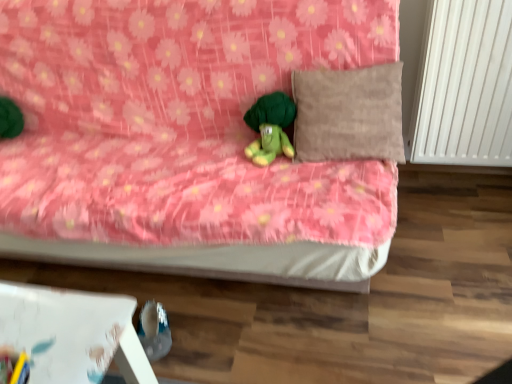
Measure the distance between pink floral fabric bed at center and camera.

The distance of pink floral fabric bed at center from camera is 3.65 feet.

Find the location of a particular element. white smooth radiator at right is located at coordinates click(x=464, y=86).

You are a GUI agent. You are given a task and a screenshot of the screen. Output one action in this format:
    pyautogui.click(x=<x>, y=<y>)
    Task: Click on the suede-like beige pillow at upper right
    This screenshot has width=512, height=384.
    Given the screenshot: What is the action you would take?
    pyautogui.click(x=349, y=114)

Where is `pink floral fabric bed at center`? This screenshot has width=512, height=384. pink floral fabric bed at center is located at coordinates (186, 139).

From the image's perspective, which is above, suede-like beige pillow at upper right or white smooth radiator at right?

white smooth radiator at right is shown above in the image.

Considering the relative positions of suede-like beige pillow at upper right and white smooth radiator at right in the image provided, is suede-like beige pillow at upper right to the left or to the right of white smooth radiator at right?

suede-like beige pillow at upper right is to the left of white smooth radiator at right.

Is suede-like beige pillow at upper right bigger or smaller than white smooth radiator at right?

In the image, suede-like beige pillow at upper right appears to be smaller than white smooth radiator at right.

How different are the orientations of suede-like beige pillow at upper right and white smooth radiator at right in degrees?

The angular difference between suede-like beige pillow at upper right and white smooth radiator at right is 4.84 degrees.

Which is closer, (x=248, y=113) or (x=471, y=134)?

Point (x=248, y=113).

From a real-world perspective, does green plush turtle at center stand above white smooth radiator at right?

Yes, from a real-world perspective, green plush turtle at center is on top of white smooth radiator at right.

Does green plush turtle at center come behind white smooth radiator at right?

Yes, it is.

Is green plush turtle at center far away from white smooth radiator at right?

green plush turtle at center is actually quite close to white smooth radiator at right.

Find the location of a particular element. toy below the suede-like beige pillow at upper right (from the image's perspective) is located at coordinates (270, 127).

Is suede-like beige pillow at upper right touching green plush turtle at center?

No.

How many degrees apart are the facing directions of suede-like beige pillow at upper right and green plush turtle at center?

The facing directions of suede-like beige pillow at upper right and green plush turtle at center are 7.83e-05 degrees apart.

Which of these two, suede-like beige pillow at upper right or green plush turtle at center, is wider?

Wider between the two is suede-like beige pillow at upper right.

Considering the sizes of green plush turtle at center and suede-like beige pillow at upper right in the image, is green plush turtle at center taller or shorter than suede-like beige pillow at upper right?

Clearly, green plush turtle at center is shorter compared to suede-like beige pillow at upper right.

Is green plush turtle at center in contact with suede-like beige pillow at upper right?

No, green plush turtle at center is not beside suede-like beige pillow at upper right.

Between green plush turtle at center and suede-like beige pillow at upper right, which one is positioned in front?

suede-like beige pillow at upper right is more forward.

From a real-world perspective, does green plush turtle at center stand above suede-like beige pillow at upper right?

No, from a real-world perspective, green plush turtle at center is not on top of suede-like beige pillow at upper right.

Based on the photo, considering the relative sizes of green plush turtle at center and pink floral fabric bed at center in the image provided, is green plush turtle at center shorter than pink floral fabric bed at center?

Yes, green plush turtle at center is shorter than pink floral fabric bed at center.

From a real-world perspective, which object rests below the other?

pink floral fabric bed at center, from a real-world perspective.

Between green plush turtle at center and pink floral fabric bed at center, which one has larger width?

With larger width is pink floral fabric bed at center.

Is green plush turtle at center positioned far away from pink floral fabric bed at center?

green plush turtle at center is near pink floral fabric bed at center, not far away.

Considering the points (198, 145) and (421, 135), which point is in front, point (198, 145) or point (421, 135)?

Point (198, 145)

Is pink floral fabric bed at center aimed at white smooth radiator at right?

No.

Looking at the image, does pink floral fabric bed at center seem bigger or smaller compared to white smooth radiator at right?

Considering their sizes, pink floral fabric bed at center takes up more space than white smooth radiator at right.

Measure the distance between pink floral fabric bed at center and white smooth radiator at right.

A distance of 29.04 inches exists between pink floral fabric bed at center and white smooth radiator at right.

In terms of width, does white smooth radiator at right look wider or thinner when compared to pink floral fabric bed at center?

Considering their sizes, white smooth radiator at right looks slimmer than pink floral fabric bed at center.

Which is behind, point (437, 93) or point (342, 224)?

Positioned behind is point (437, 93).

Is white smooth radiator at right behind pink floral fabric bed at center?

Yes, white smooth radiator at right is further from the camera.

Is white smooth radiator at right to the left of pink floral fabric bed at center from the viewer's perspective?

No.

This screenshot has height=384, width=512. In order to click on radiator on the right side of suede-like beige pillow at upper right in this screenshot , I will do `click(464, 86)`.

At what (x,y) coordinates should I click in order to perform the action: click on radiator below the green plush turtle at center (from a real-world perspective). Please return your answer as a coordinate pair (x, y). The width and height of the screenshot is (512, 384). Looking at the image, I should click on (464, 86).

Looking at the image, which one is located closer to suede-like beige pillow at upper right, green plush turtle at center or pink floral fabric bed at center?

Based on the image, green plush turtle at center appears to be nearer to suede-like beige pillow at upper right.

Estimate the real-world distances between objects in this image. Which object is further from green plush turtle at center, white smooth radiator at right or pink floral fabric bed at center?

white smooth radiator at right.

In the scene shown: From the image, which object appears to be farther from pink floral fabric bed at center, green plush turtle at center or suede-like beige pillow at upper right?

green plush turtle at center lies further to pink floral fabric bed at center than the other object.

Which object lies nearer to the anchor point suede-like beige pillow at upper right, pink floral fabric bed at center or green plush turtle at center?

Based on the image, green plush turtle at center appears to be nearer to suede-like beige pillow at upper right.

When comparing their distances from green plush turtle at center, does white smooth radiator at right or suede-like beige pillow at upper right seem further?

white smooth radiator at right lies further to green plush turtle at center than the other object.

When comparing their distances from suede-like beige pillow at upper right, does white smooth radiator at right or green plush turtle at center seem closer?

green plush turtle at center.

From the image, which object appears to be nearer to white smooth radiator at right, green plush turtle at center or suede-like beige pillow at upper right?

suede-like beige pillow at upper right lies closer to white smooth radiator at right than the other object.

Estimate the real-world distances between objects in this image. Which object is closer to suede-like beige pillow at upper right, pink floral fabric bed at center or white smooth radiator at right?

pink floral fabric bed at center is positioned closer to the anchor suede-like beige pillow at upper right.

Where is `pillow situated between green plush turtle at center and white smooth radiator at right from left to right`? The height and width of the screenshot is (384, 512). pillow situated between green plush turtle at center and white smooth radiator at right from left to right is located at coordinates (349, 114).

The image size is (512, 384). In order to click on pillow situated between pink floral fabric bed at center and white smooth radiator at right from left to right in this screenshot , I will do `click(349, 114)`.

Identify the location of toy between pink floral fabric bed at center and suede-like beige pillow at upper right from left to right. (270, 127).

Where is `toy between pink floral fabric bed at center and white smooth radiator at right from left to right`? toy between pink floral fabric bed at center and white smooth radiator at right from left to right is located at coordinates (270, 127).